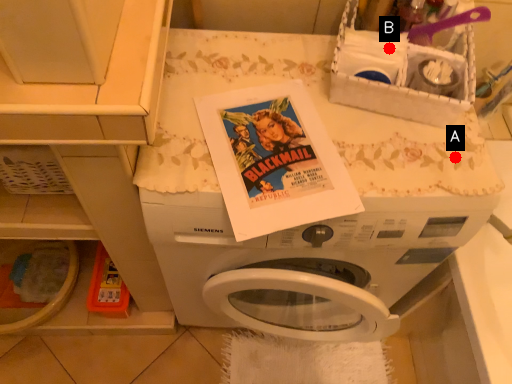
Question: Two points are circled on the image, labeled by A and B beside each circle. Which point appears farthest from the camera in this image?

Choices:
 (A) A is further
 (B) B is further

Answer: (A)